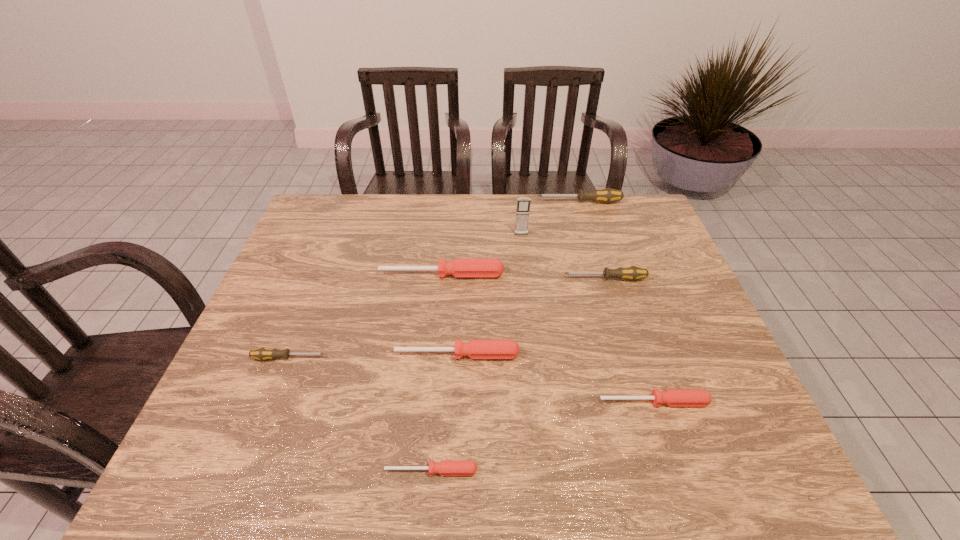
You are a GUI agent. You are given a task and a screenshot of the screen. Output one action in this format:
    pyautogui.click(x=<x>, y=<y>)
    Task: Click on the vacant space at the far edge of the desktop
    This screenshot has width=960, height=540.
    Given the screenshot: What is the action you would take?
    pyautogui.click(x=534, y=208)

In the image, there is a desktop. Where is `free space at the near edge`? This screenshot has height=540, width=960. free space at the near edge is located at coordinates (520, 478).

This screenshot has height=540, width=960. In the image, there is a desktop. Identify the location of free space at the right edge. (677, 294).

You are a GUI agent. You are given a task and a screenshot of the screen. Output one action in this format:
    pyautogui.click(x=<x>, y=<y>)
    Task: Click on the free space at the far left corner
    The height and width of the screenshot is (540, 960).
    Given the screenshot: What is the action you would take?
    pyautogui.click(x=359, y=194)

The height and width of the screenshot is (540, 960). What are the coordinates of `free point between the leftmost screwdriver and the biggest gray screwdriver` in the screenshot? It's located at (x=434, y=280).

Where is `empty location between the seventh farthest object and the cellular telephone`? This screenshot has height=540, width=960. empty location between the seventh farthest object and the cellular telephone is located at coordinates (588, 319).

The width and height of the screenshot is (960, 540). Identify the location of vacant region between the biggest red screwdriver and the nearest gray screwdriver. (365, 316).

Find the location of a particular element. The image size is (960, 540). vacant space that's between the nearest red screwdriver and the second biggest red screwdriver is located at coordinates (444, 413).

Where is `vacant space that's between the farthest red screwdriver and the fifth object from left to right`? vacant space that's between the farthest red screwdriver and the fifth object from left to right is located at coordinates 481,255.

The width and height of the screenshot is (960, 540). Find the location of `free point between the second farthest gray screwdriver and the nearest object`. free point between the second farthest gray screwdriver and the nearest object is located at coordinates (517, 375).